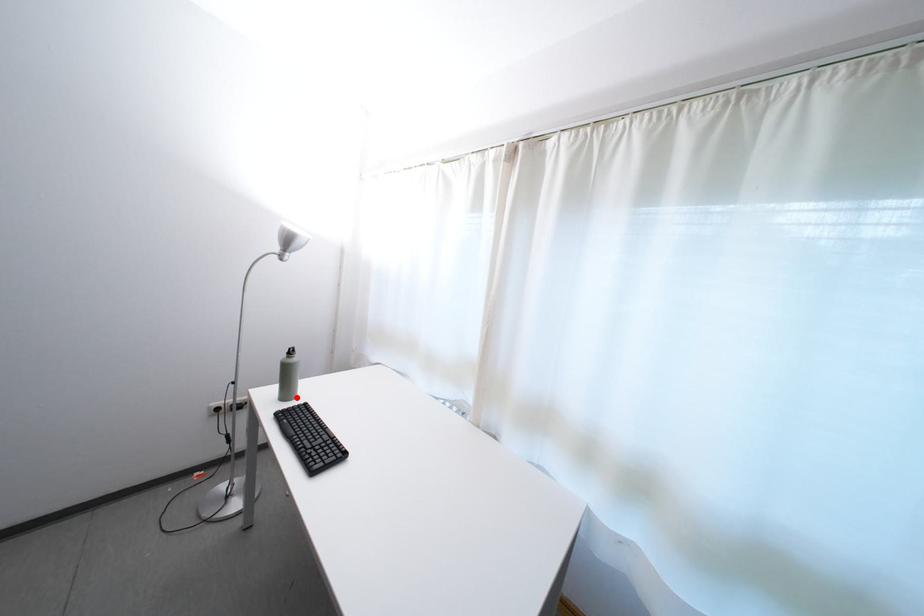
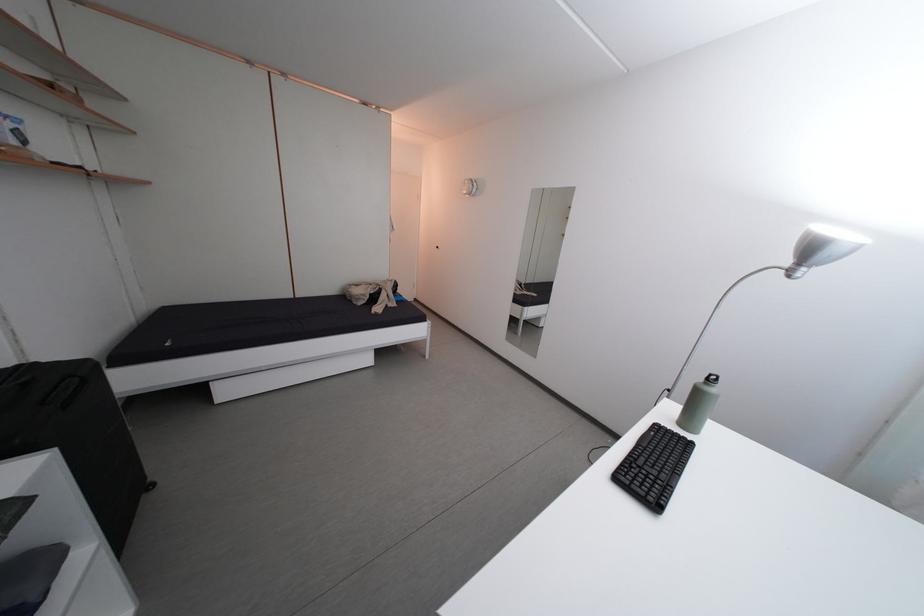
Locate, in the second image, the point that corresponds to the highlighted location in the first image.

(699, 427)